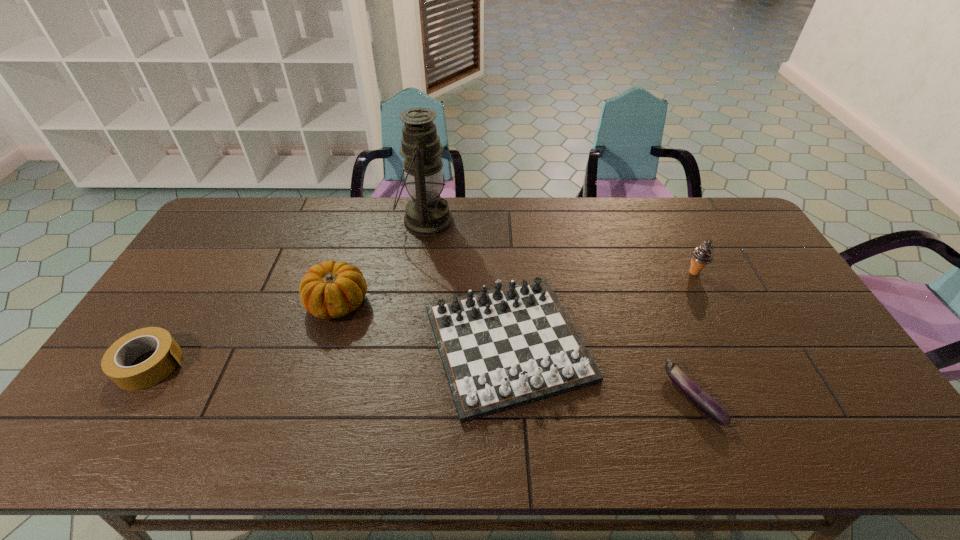
Where is `vacant area between the eggplant and the duct tape`? vacant area between the eggplant and the duct tape is located at coordinates (421, 381).

Where is `vacant region between the second object from right to left and the fifth tallest object`? The height and width of the screenshot is (540, 960). vacant region between the second object from right to left and the fifth tallest object is located at coordinates [421, 381].

Locate an element on the screen. empty space that is in between the chessboard and the second object from right to left is located at coordinates (600, 370).

Where is `empty location between the fifth object from right to left and the oil lamp`? empty location between the fifth object from right to left and the oil lamp is located at coordinates (382, 262).

Where is `free area in between the leftmost object and the gourd`? This screenshot has height=540, width=960. free area in between the leftmost object and the gourd is located at coordinates (245, 334).

In order to click on free space that is in between the fourth shortest object and the chessboard in this screenshot , I will do `click(422, 323)`.

The width and height of the screenshot is (960, 540). Find the location of `free area in between the oil lamp and the chessboard`. free area in between the oil lamp and the chessboard is located at coordinates [467, 282].

Where is `object identified as the closest to the duct tape`? This screenshot has width=960, height=540. object identified as the closest to the duct tape is located at coordinates (331, 289).

Identify the location of object that is the closest to the shortest object. (502, 348).

In order to click on vacant space that satisfies the following two spatial constraints: 1. on the front side of the tallest object; 2. on the right side of the shortest object in this screenshot , I will do `click(400, 396)`.